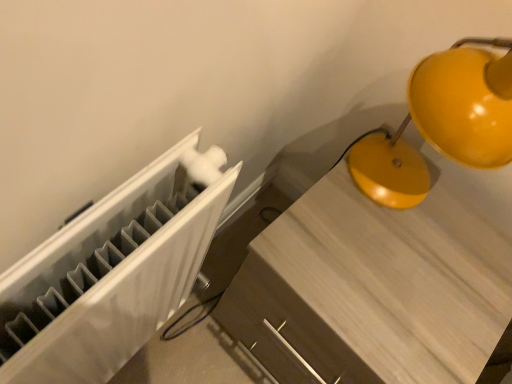
You are a GUI agent. You are given a task and a screenshot of the screen. Output one action in this format:
    pyautogui.click(x=<x>, y=<y>)
    Task: Click on the vacant region in front of matte yellow lamp at upper right
    The width and height of the screenshot is (512, 384).
    Given the screenshot: What is the action you would take?
    pyautogui.click(x=369, y=260)